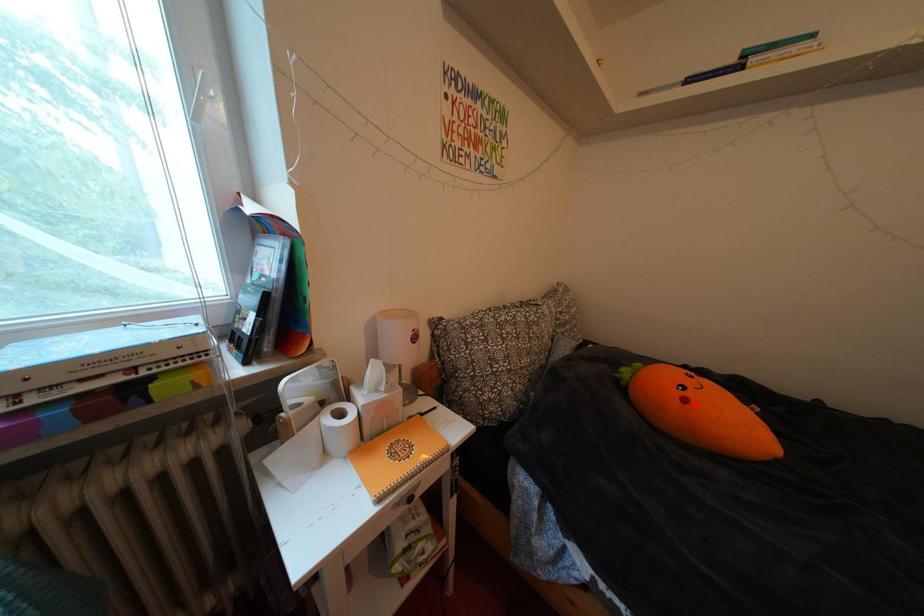
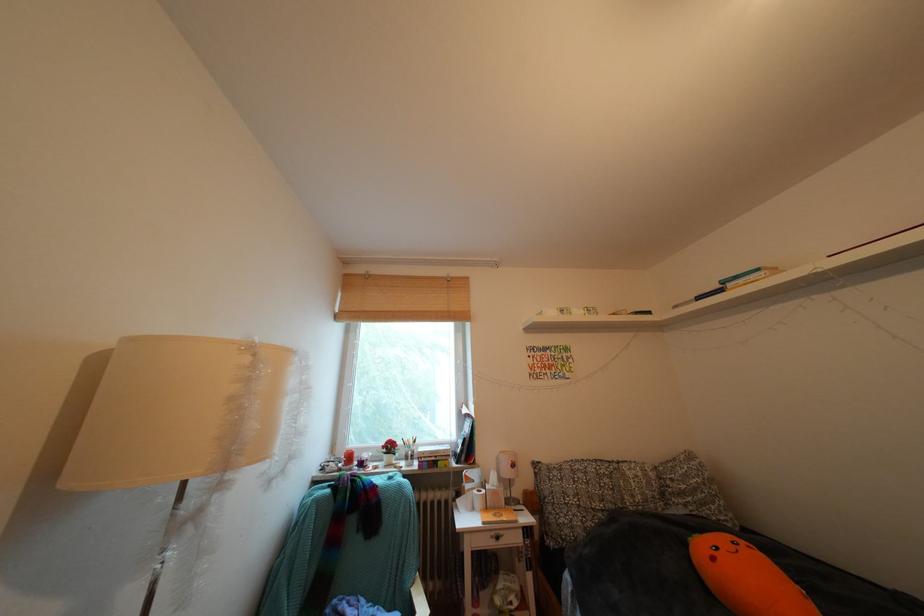
In the second image, find the point that corresponds to the highlighted location in the first image.

(723, 564)